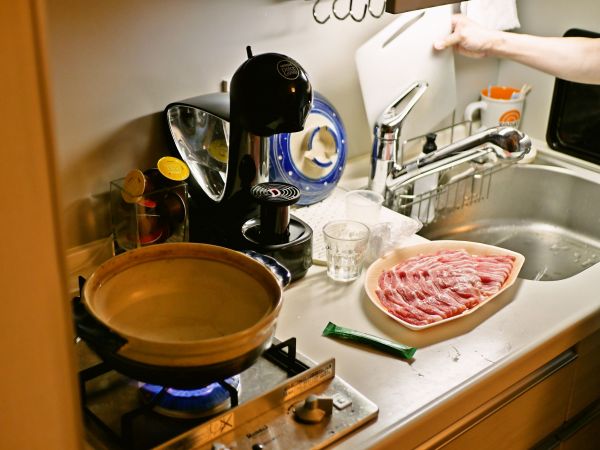
Where is `dish`? The width and height of the screenshot is (600, 450). dish is located at coordinates (299, 152).